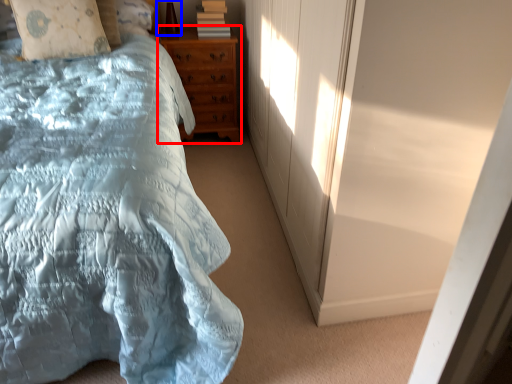
Question: Among these objects, which one is farthest to the camera, chest of drawers (highlighted by a red box) or table lamp (highlighted by a blue box)?

Choices:
 (A) chest of drawers
 (B) table lamp

Answer: (A)